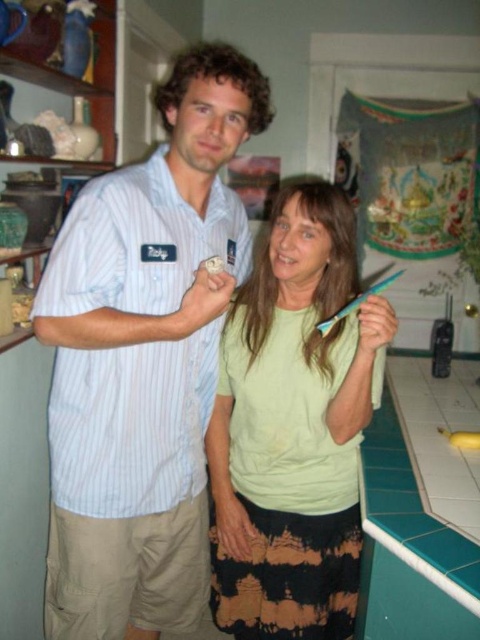
Question: Which point is farther to the camera?

Choices:
 (A) green matte shirt at center
 (B) green tile countertop at lower right
 (C) white striped shirt at center

Answer: (A)

Question: Which object appears farthest from the camera in this image?

Choices:
 (A) green matte shirt at center
 (B) white striped shirt at center

Answer: (A)

Question: Is green matte shirt at center bigger than green tile countertop at lower right?

Choices:
 (A) no
 (B) yes

Answer: (B)

Question: Is white striped shirt at center above green matte shirt at center?

Choices:
 (A) no
 (B) yes

Answer: (B)

Question: Which is farther from the green matte shirt at center?

Choices:
 (A) white striped shirt at center
 (B) green tile countertop at lower right

Answer: (B)

Question: Is green matte shirt at center to the right of green tile countertop at lower right from the viewer's perspective?

Choices:
 (A) no
 (B) yes

Answer: (A)